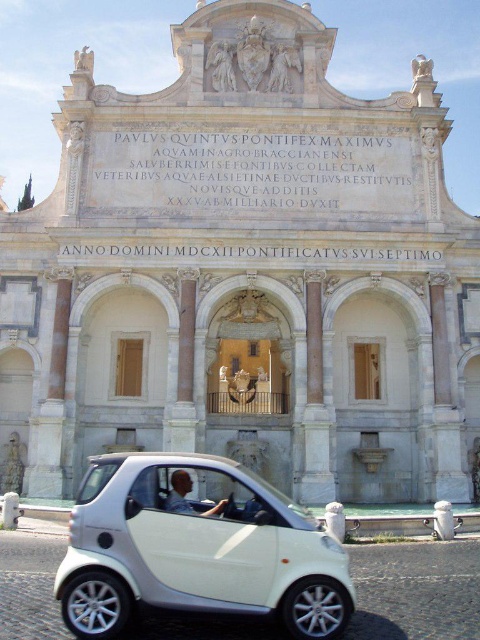
Is point (206, 522) in front of point (182, 476)?

That is True.

Does white matte car at lower center appear over light blue shirt at center?

No.

Identify the location of white matte car at lower center. This screenshot has height=640, width=480. (195, 548).